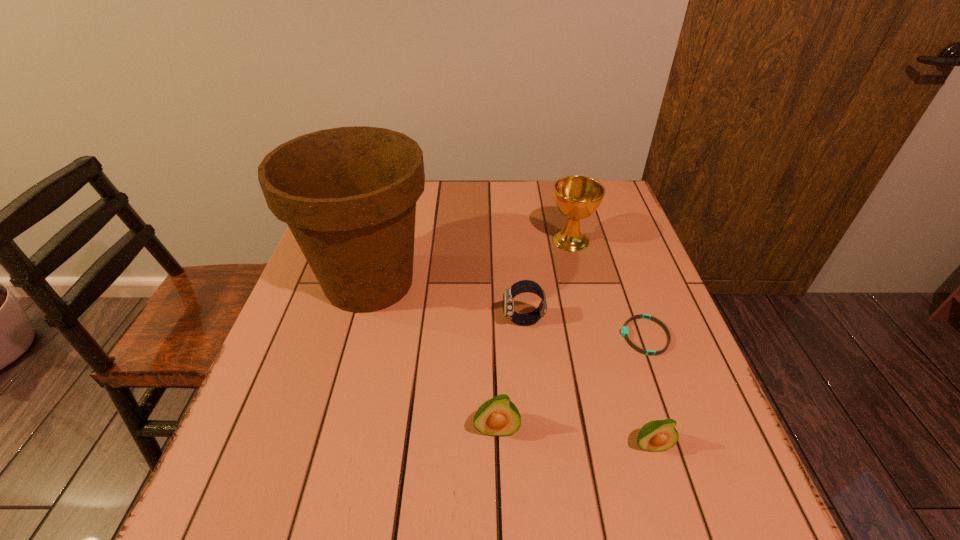
Locate an element on the screen. vacant area situated 0.180m on the face of the watch is located at coordinates (424, 321).

At what (x,y) coordinates should I click in order to perform the action: click on free point located 0.330m on the face of the watch. Please return your answer as a coordinate pair (x, y). The image size is (960, 540). Looking at the image, I should click on (359, 321).

The image size is (960, 540). I want to click on vacant space located 0.070m on the buckle of the shortest object, so click(x=589, y=336).

This screenshot has width=960, height=540. Find the location of `vacant space located 0.340m on the buckle of the shortest object`. vacant space located 0.340m on the buckle of the shortest object is located at coordinates (468, 336).

In order to click on free space located on the buckle of the shortest object in this screenshot , I will do `click(509, 336)`.

Where is `object that is positioned at the left edge`? Image resolution: width=960 pixels, height=540 pixels. object that is positioned at the left edge is located at coordinates (348, 194).

Locate an element on the screen. avocado that is at the right edge is located at coordinates (659, 435).

Locate an element on the screen. chalice present at the right edge is located at coordinates (577, 197).

Find the location of a particular element. The width and height of the screenshot is (960, 540). wristband situated at the right edge is located at coordinates (624, 331).

The height and width of the screenshot is (540, 960). Find the location of `object that is at the near right corner`. object that is at the near right corner is located at coordinates (659, 435).